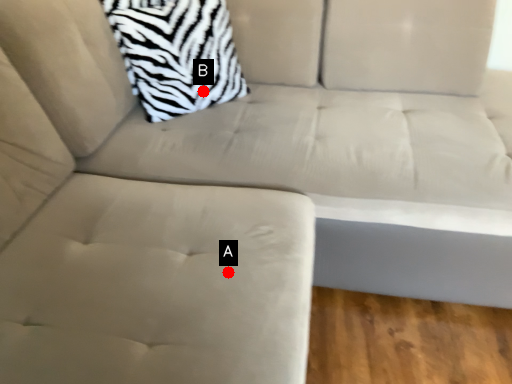
Question: Two points are circled on the image, labeled by A and B beside each circle. Among these points, which one is farthest from the camera?

Choices:
 (A) A is further
 (B) B is further

Answer: (B)